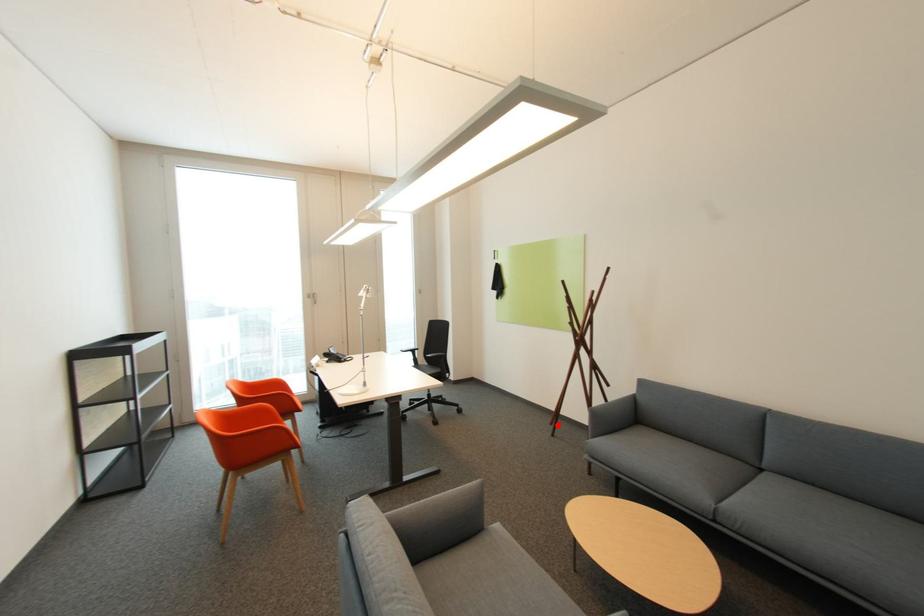
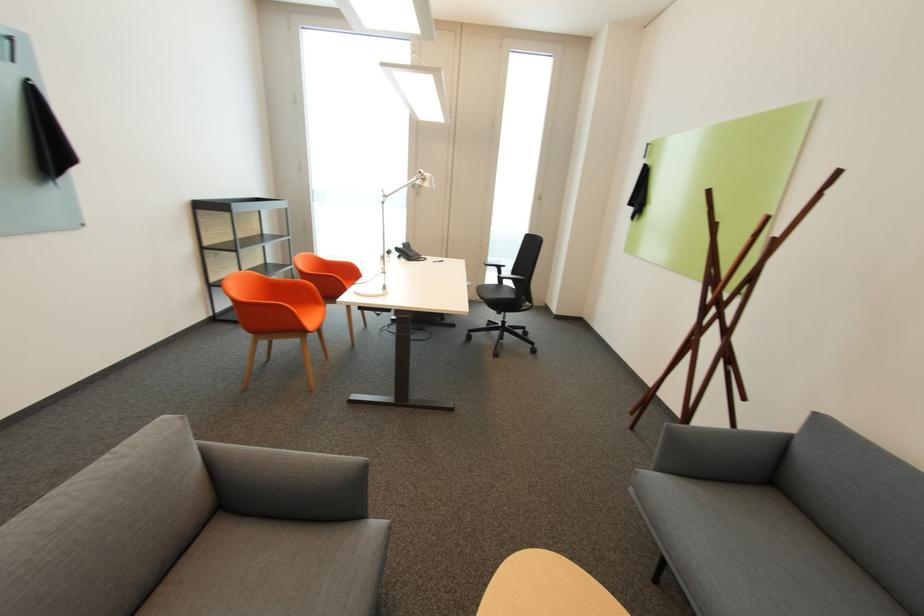
The point at the highlighted location is marked in the first image. Where is the corresponding point in the second image?

(638, 414)